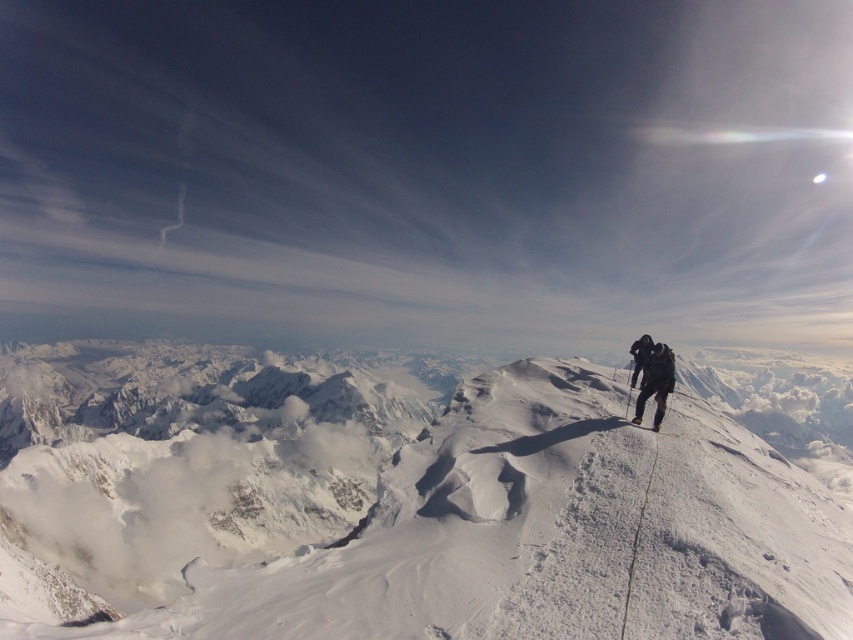
Question: Is white snow-covered mountain at upper center below black fabric pants at center?

Choices:
 (A) no
 (B) yes

Answer: (B)

Question: Does white snow-covered mountain at upper center have a larger size compared to black fabric pants at center?

Choices:
 (A) no
 (B) yes

Answer: (B)

Question: Does white snow-covered mountain at upper center appear on the right side of black fabric pants at center?

Choices:
 (A) yes
 (B) no

Answer: (A)